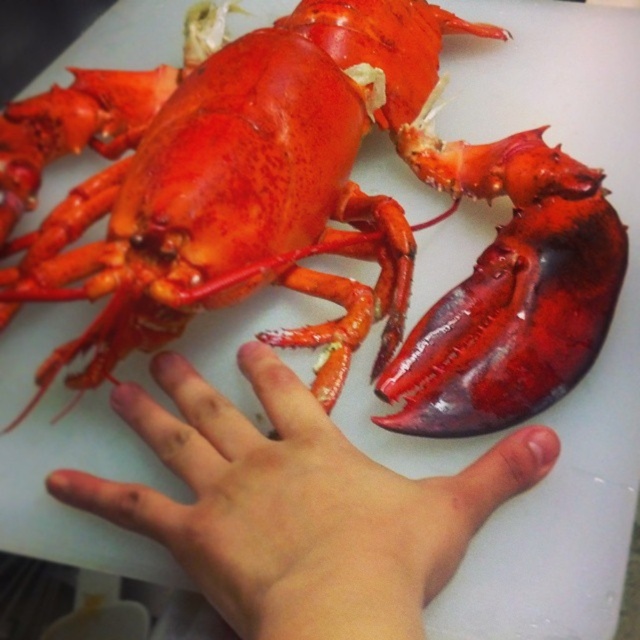
Does point (572, 192) lie in front of point (218, 593)?

No, (572, 192) is behind (218, 593).

Is shiny red lobster at center wider than pale skin palm at center?

Indeed, shiny red lobster at center has a greater width compared to pale skin palm at center.

I want to click on shiny red lobster at center, so click(332, 218).